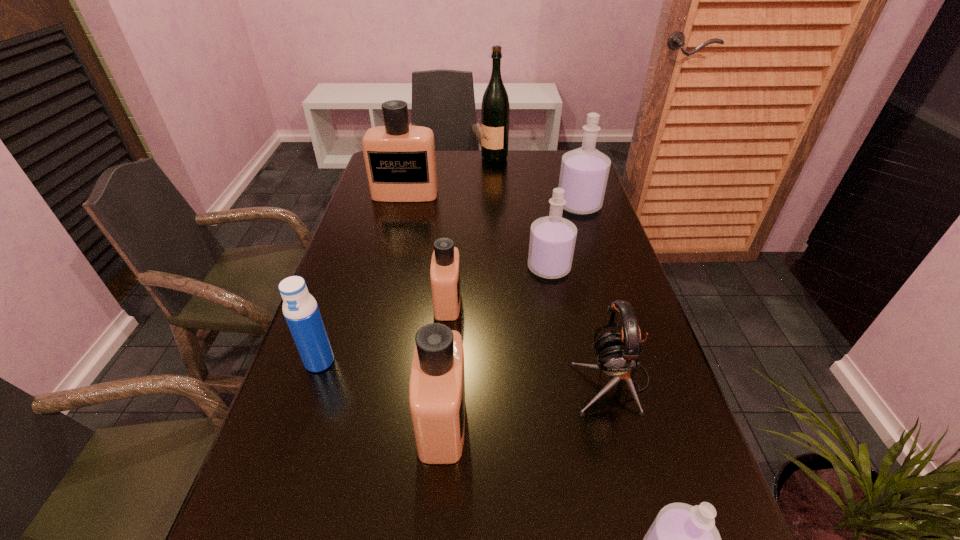
Where is `vacant space in between the earphone and the biggest purple perfume`? The width and height of the screenshot is (960, 540). vacant space in between the earphone and the biggest purple perfume is located at coordinates (595, 293).

The image size is (960, 540). Identify the location of free space between the fifth farthest perfume and the farthest purple perfume. (511, 313).

This screenshot has height=540, width=960. Identify the location of unoccupied position between the farthest object and the second nearest perfume. click(x=468, y=289).

Locate an element on the screen. unoccupied position between the farthest purple perfume and the liquor is located at coordinates (537, 181).

Image resolution: width=960 pixels, height=540 pixels. What are the coordinates of `vacant space that's between the liquor and the fifth farthest perfume` in the screenshot? It's located at (468, 289).

The image size is (960, 540). In order to click on object that is the eighth closest to the second smallest beige perfume in this screenshot , I will do `click(495, 110)`.

Locate an element on the screen. The width and height of the screenshot is (960, 540). the third closest object to the second nearest perfume is located at coordinates (618, 353).

This screenshot has height=540, width=960. Find the location of `perfume that stands as the third closest to the farthest purple perfume`. perfume that stands as the third closest to the farthest purple perfume is located at coordinates (445, 264).

Identify which perfume is located as the nearest to the farthest purple perfume. Please provide its 2D coordinates. Your answer should be formatted as a tuple, i.e. [(x, y)], where the tuple contains the x and y coordinates of a point satisfying the conditions above.

[(552, 238)]

Find the location of `beige perfume that is the second closest one to the smallest beige perfume`. beige perfume that is the second closest one to the smallest beige perfume is located at coordinates (400, 159).